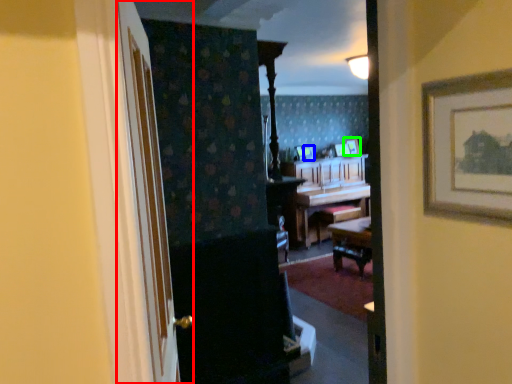
Question: Based on their relative distances, which object is farther from door (highlighted by a red box)? Choose from picture frame (highlighted by a blue box) and picture frame (highlighted by a green box).

Choices:
 (A) picture frame
 (B) picture frame

Answer: (B)